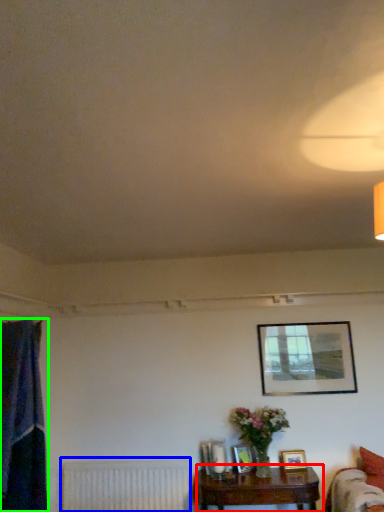
Question: Which object is the closest to the table (highlighted by a red box)? Choose among these: radiator (highlighted by a blue box) or curtain (highlighted by a green box).

Choices:
 (A) radiator
 (B) curtain

Answer: (A)